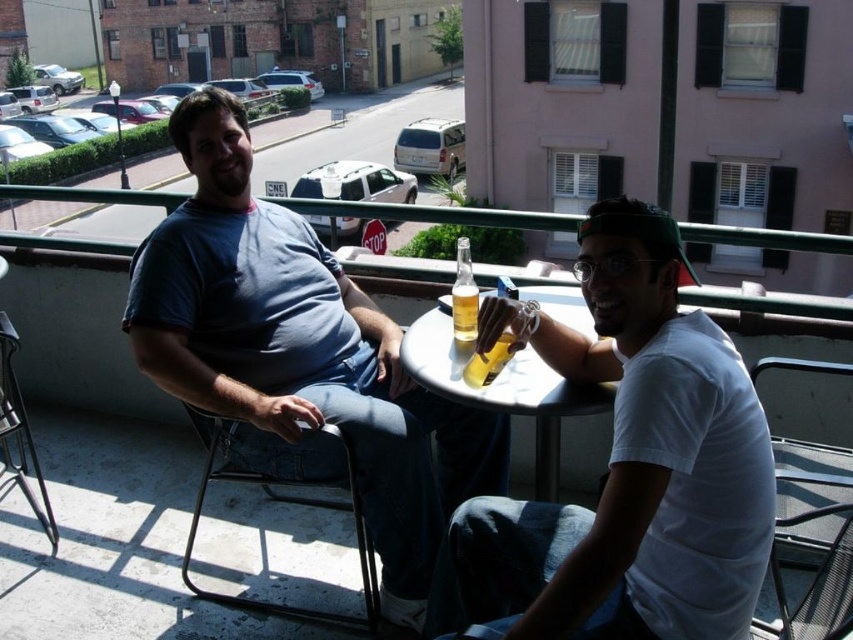
Is metallic black chair at lower left closer to camera compared to translucent glass beer at table center?

No.

Who is positioned more to the right, metallic black chair at lower left or translucent glass beer at table center?

translucent glass beer at table center

Locate an element on the screen. The image size is (853, 640). metallic black chair at lower left is located at coordinates (19, 433).

Consider the image. Is metallic gray chair at lower right shorter than metallic black chair at lower left?

Yes.

Can you confirm if metallic gray chair at lower right is taller than metallic black chair at lower left?

Incorrect, metallic gray chair at lower right's height is not larger of metallic black chair at lower left's.

Which is behind, point (776, 580) or point (12, 412)?

The point (12, 412) is more distant.

The height and width of the screenshot is (640, 853). I want to click on metallic gray chair at lower right, so click(x=815, y=586).

Between metallic gray chair at left and metallic gray chair at lower right, which one has more height?

metallic gray chair at left

Who is lower down, metallic gray chair at left or metallic gray chair at lower right?

metallic gray chair at lower right

Is point (239, 477) positioned before point (795, 616)?

That is False.

I want to click on metallic gray chair at left, so click(286, 502).